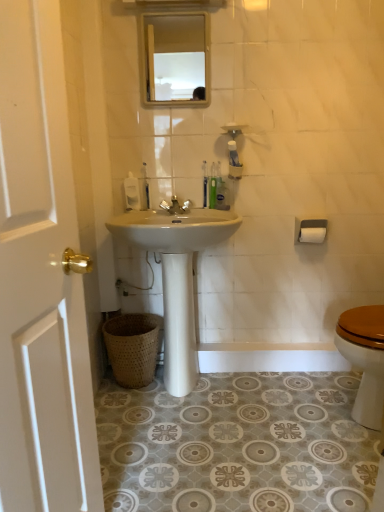
Question: Should I look upward or downward to see clear glass mirror at upper center?

Choices:
 (A) up
 (B) down

Answer: (A)

Question: Could green plastic toothbrush at upper center, the third toothbrush in the left-to-right sequence, be considered to be inside white glossy sink at center?

Choices:
 (A) yes
 (B) no

Answer: (B)

Question: Is white glossy sink at center oriented towards green plastic toothbrush at upper center, the third toothbrush in the left-to-right sequence?

Choices:
 (A) no
 (B) yes

Answer: (A)

Question: Is white glossy sink at center not within green plastic toothbrush at upper center, the third toothbrush in the left-to-right sequence?

Choices:
 (A) yes
 (B) no

Answer: (A)

Question: From the image's perspective, is white glossy sink at center over green plastic toothbrush at upper center, the third toothbrush in the left-to-right sequence?

Choices:
 (A) yes
 (B) no

Answer: (B)

Question: Considering the relative sizes of white glossy sink at center and green plastic toothbrush at upper center, placed as the 1th toothbrush when sorted from right to left, in the image provided, is white glossy sink at center bigger than green plastic toothbrush at upper center, placed as the 1th toothbrush when sorted from right to left,?

Choices:
 (A) no
 (B) yes

Answer: (B)

Question: Is white glossy sink at center positioned with its back to green plastic toothbrush at upper center, the third toothbrush in the left-to-right sequence?

Choices:
 (A) yes
 (B) no

Answer: (B)

Question: From the image's perspective, is white matte toilet paper at right below clear glass mirror at upper center?

Choices:
 (A) yes
 (B) no

Answer: (A)

Question: From the image's perspective, does white matte toilet paper at right appear higher than clear glass mirror at upper center?

Choices:
 (A) no
 (B) yes

Answer: (A)

Question: Is white matte toilet paper at right closer to camera compared to clear glass mirror at upper center?

Choices:
 (A) yes
 (B) no

Answer: (B)

Question: Can you confirm if white matte toilet paper at right is positioned to the left of clear glass mirror at upper center?

Choices:
 (A) no
 (B) yes

Answer: (A)

Question: From a real-world perspective, is white matte toilet paper at right on clear glass mirror at upper center?

Choices:
 (A) yes
 (B) no

Answer: (B)

Question: Can you confirm if white matte toilet paper at right is thinner than clear glass mirror at upper center?

Choices:
 (A) no
 (B) yes

Answer: (A)

Question: From the image's perspective, is white glossy sink at center on translucent plastic toothbrush at center, the 2th toothbrush viewed from the left?

Choices:
 (A) yes
 (B) no

Answer: (B)